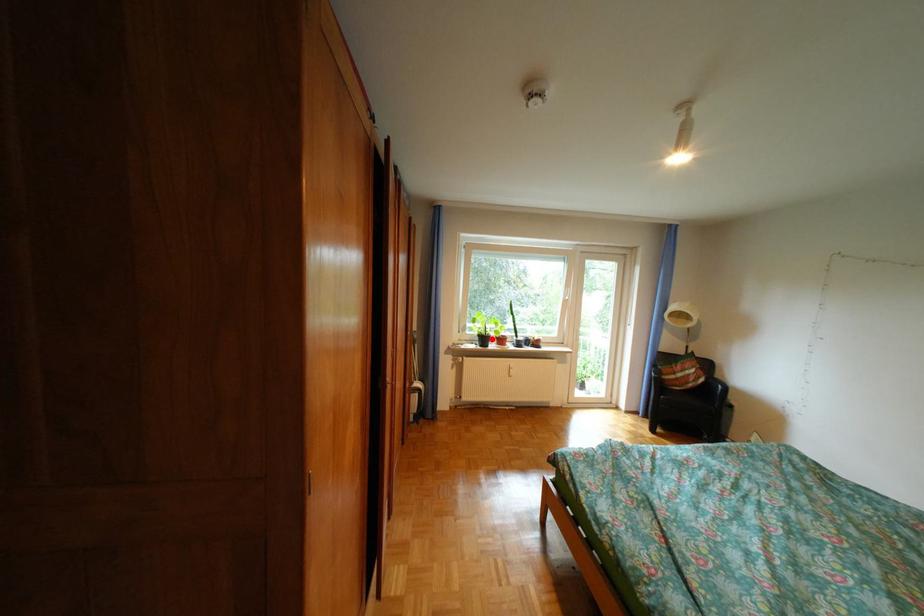
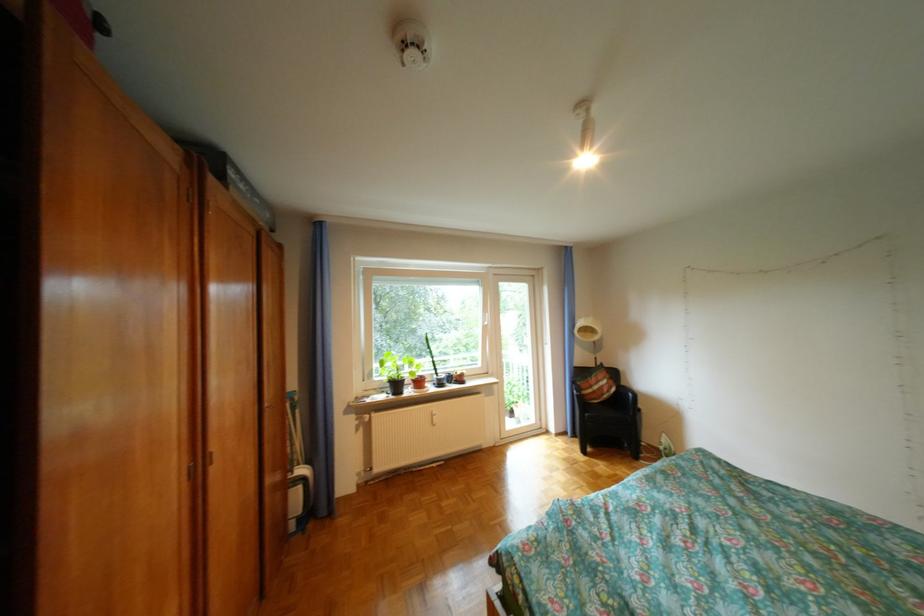
The point at the highlighted location is marked in the first image. Where is the corresponding point in the second image?

(403, 386)